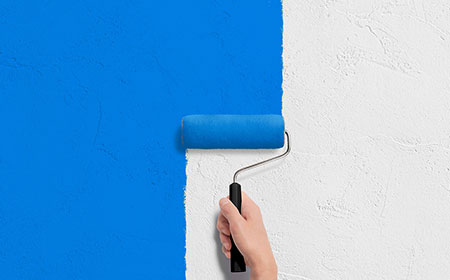
Image resolution: width=450 pixels, height=280 pixels. What are the coordinates of `handle` in the screenshot? It's located at (235, 196).